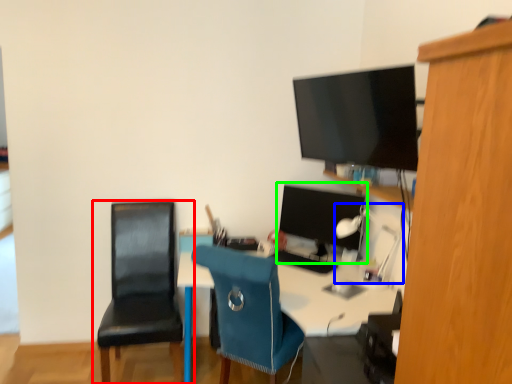
Question: Estimate the real-world distances between objects in this image. Which object is farther from chair (highlighted by a red box), lamp (highlighted by a blue box) or computer monitor (highlighted by a green box)?

Choices:
 (A) lamp
 (B) computer monitor

Answer: (A)